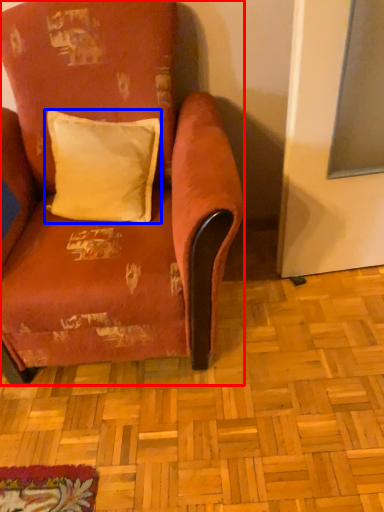
Question: Which object is closer to the camera taking this photo, chair (highlighted by a red box) or pillow (highlighted by a blue box)?

Choices:
 (A) chair
 (B) pillow

Answer: (A)